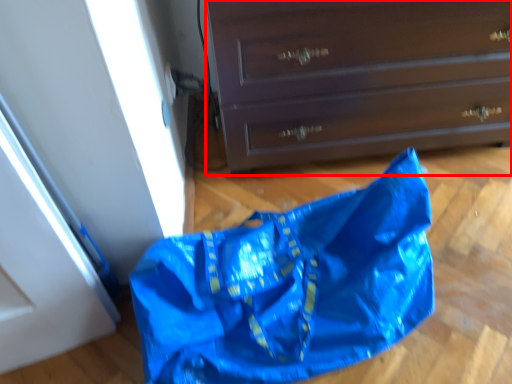
Question: From the image's perspective, where is chest of drawers (annotated by the red box) located relative to grocery bag?

Choices:
 (A) above
 (B) below

Answer: (A)